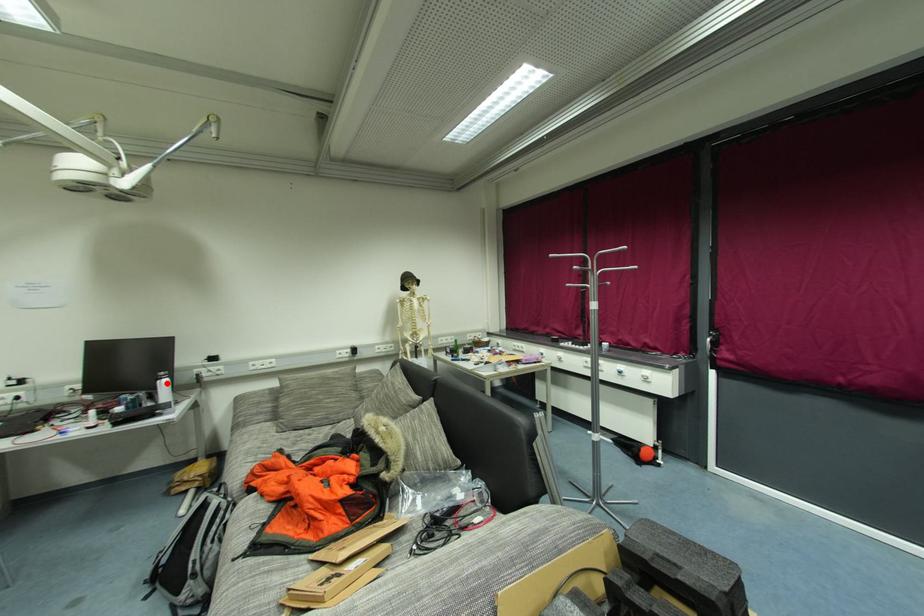
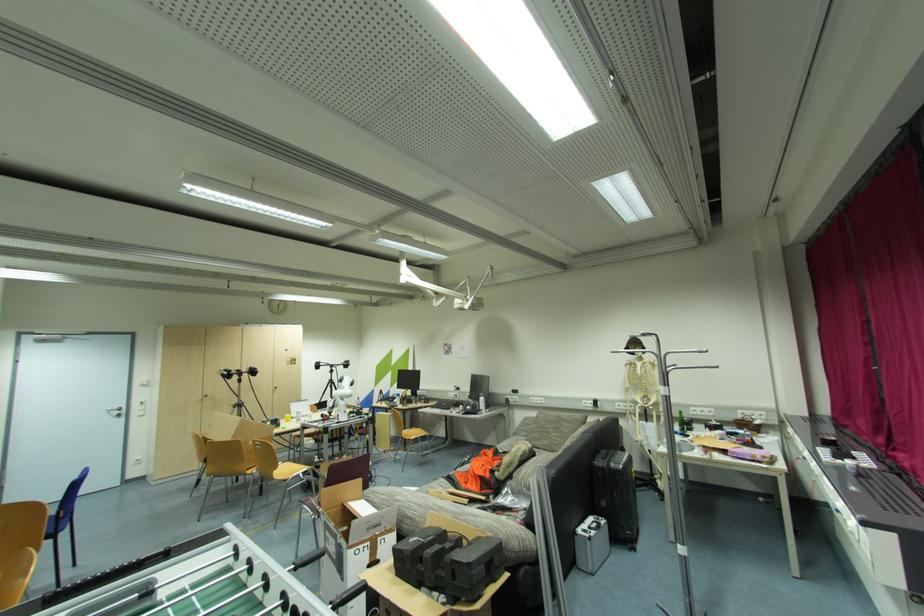
Question: I am providing you with two images of the same scene from different viewpoints. A red point is shown in image1. For the corresponding object point in image2, is it positioned nearer or farther from the camera?

Choices:
 (A) Nearer
 (B) Farther

Answer: (B)